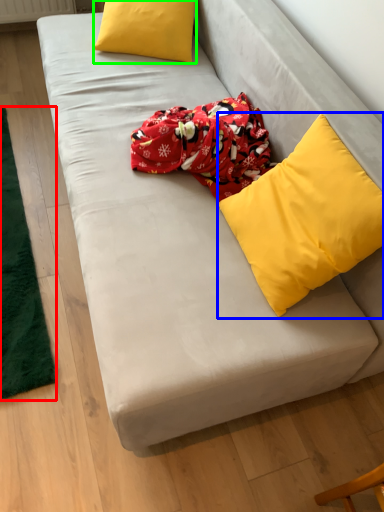
Question: Which object is the closest to the mat (highlighted by a red box)? Choose among these: pillow (highlighted by a blue box) or pillow (highlighted by a green box).

Choices:
 (A) pillow
 (B) pillow

Answer: (B)